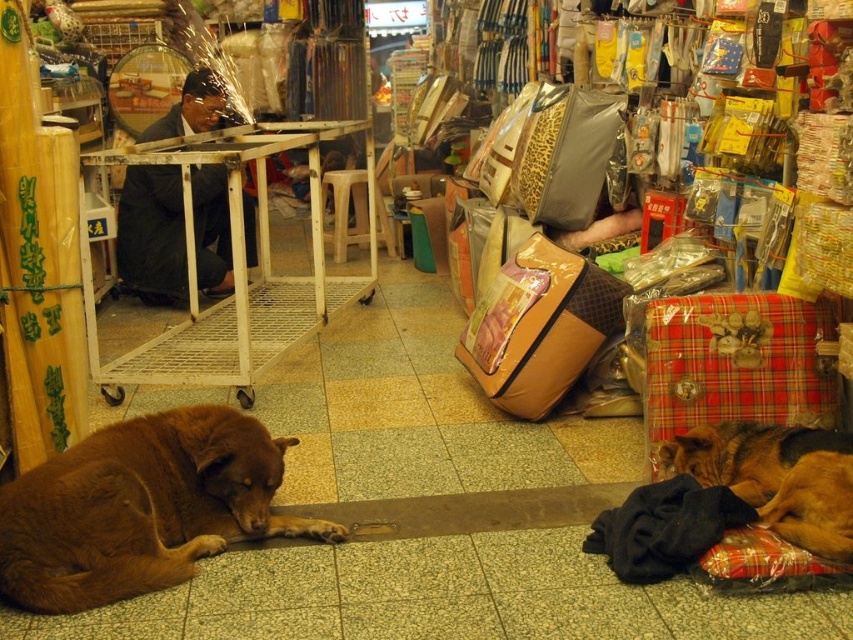
Between point (28, 577) and point (123, 218), which one is positioned in front?

Point (28, 577) is more forward.

Between brown furry dog at lower left and dark suit at center, which one is positioned higher?

dark suit at center is above.

Is point (65, 456) farther from viewer compared to point (206, 224)?

That is False.

Identify the location of brown furry dog at lower left. The image size is (853, 640). (141, 508).

Between brown furry dog at lower left and brown furry dog at lower right, which one is positioned higher?

brown furry dog at lower right is above.

Does brown furry dog at lower left have a larger size compared to brown furry dog at lower right?

Yes.

Is point (1, 577) positioned behind point (677, 440)?

No.

This screenshot has width=853, height=640. Identify the location of brown furry dog at lower left. (141, 508).

What do you see at coordinates (152, 234) in the screenshot? This screenshot has height=640, width=853. I see `dark suit at center` at bounding box center [152, 234].

Who is taller, dark suit at center or brown furry dog at lower right?

dark suit at center is taller.

Image resolution: width=853 pixels, height=640 pixels. What are the coordinates of `dark suit at center` in the screenshot? It's located at (152, 234).

Where is `dark suit at center`? The height and width of the screenshot is (640, 853). dark suit at center is located at coordinates (152, 234).